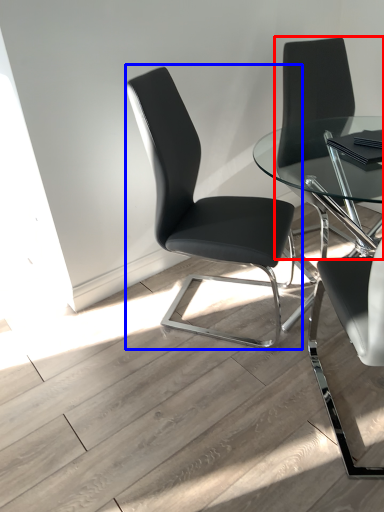
Question: Which object appears closest to the camera in this image, chair (highlighted by a red box) or chair (highlighted by a blue box)?

Choices:
 (A) chair
 (B) chair

Answer: (B)